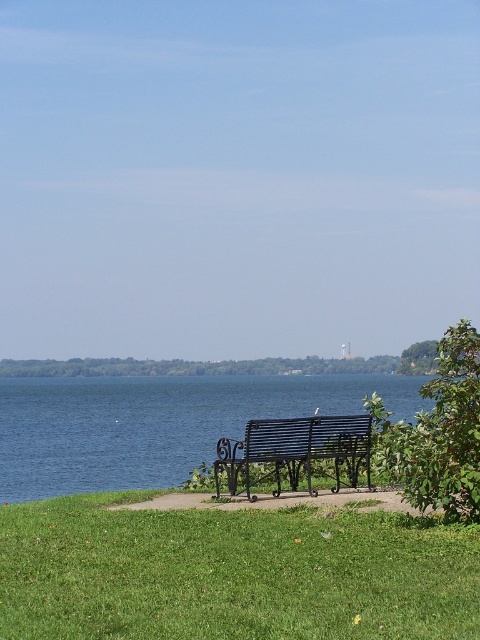
You are planning to take a photo of the black wrought iron bench at center and the blue metallic lake at center. Which object should you position closer to the left side of your camera frame to include both in the photo?

To include both the black wrought iron bench at center and the blue metallic lake at center in your photo, position the blue metallic lake at center closer to the left side of your camera frame since it is already located to the left of the bench.

You are standing at the lakeside and want to walk to the point closer to you. Which of the two points, point (328,540) or point (84,483), should you head towards?

You should head towards point (328,540) because it is closer to the viewer than point (84,483).

Looking at this image, you are planning to set up a picnic blanket on the green grass at lower center and the blue metallic lake at center. Which area would allow you to spread the blanket more comfortably?

The blue metallic lake at center is wider than the green grass at lower center, so you can spread the picnic blanket more comfortably there.